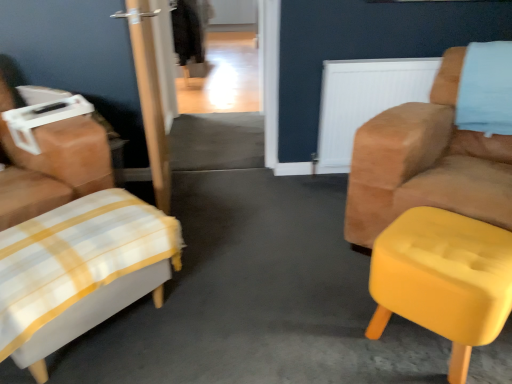
Locate an element on the screen. yellow fabric ottoman at right, arranged as the second furniture when viewed from the left is located at coordinates (443, 279).

Where is `suede tan armchair at right, the 1th chair when ordered from right to left`? The height and width of the screenshot is (384, 512). suede tan armchair at right, the 1th chair when ordered from right to left is located at coordinates (426, 163).

The width and height of the screenshot is (512, 384). Describe the element at coordinates (77, 269) in the screenshot. I see `white plaid ottoman at lower left, which is counted as the 1th furniture, starting from the left` at that location.

This screenshot has width=512, height=384. Identify the location of white textured radiator at upper right. (365, 100).

Identify the location of yellow fabric ottoman at right, which appears as the first furniture when viewed from the right. This screenshot has height=384, width=512. (443, 279).

Would you say white textured radiator at upper right is to the left or to the right of yellow fabric ottoman at right, which appears as the first furniture when viewed from the right, in the picture?

Based on their positions, white textured radiator at upper right is located to the right of yellow fabric ottoman at right, which appears as the first furniture when viewed from the right.

Considering the sizes of objects white textured radiator at upper right and yellow fabric ottoman at right, arranged as the second furniture when viewed from the left, in the image provided, who is smaller, white textured radiator at upper right or yellow fabric ottoman at right, arranged as the second furniture when viewed from the left,?

Result: With smaller size is white textured radiator at upper right.

Does white textured radiator at upper right have a lesser width compared to yellow fabric ottoman at right, which appears as the first furniture when viewed from the right?

Correct, the width of white textured radiator at upper right is less than that of yellow fabric ottoman at right, which appears as the first furniture when viewed from the right.

How different are the orientations of white textured radiator at upper right and yellow fabric ottoman at right, which appears as the first furniture when viewed from the right, in degrees?

43.5 degrees separate the facing orientations of white textured radiator at upper right and yellow fabric ottoman at right, which appears as the first furniture when viewed from the right.

Is the depth of suede tan armchair at right, the 1th chair when ordered from right to left, greater than that of white plaid ottoman at lower left, the second furniture from the right?

Yes, it is behind white plaid ottoman at lower left, the second furniture from the right.

Can you confirm if suede tan armchair at right, the 1th chair when ordered from right to left, is positioned to the right of white plaid ottoman at lower left, the second furniture from the right?

Yes, suede tan armchair at right, the 1th chair when ordered from right to left, is to the right of white plaid ottoman at lower left, the second furniture from the right.

From a real-world perspective, is suede tan armchair at right, which ranks as the second chair in left-to-right order, under white plaid ottoman at lower left, which is counted as the 1th furniture, starting from the left?

Actually, suede tan armchair at right, which ranks as the second chair in left-to-right order, is physically above white plaid ottoman at lower left, which is counted as the 1th furniture, starting from the left, in the real world.

How different are the orientations of suede tan armchair at right, the 1th chair when ordered from right to left, and white plaid ottoman at lower left, the second furniture from the right, in degrees?

They differ by 85.6 degrees in their facing directions.

Consider the image. Is suede tan armchair at right, which ranks as the second chair in left-to-right order, at the left side of white textured radiator at upper right?

No, suede tan armchair at right, which ranks as the second chair in left-to-right order, is not to the left of white textured radiator at upper right.

Which is closer to the camera, (367, 240) or (380, 100)?

The point (367, 240) is closer to the camera.

Looking at this image, is suede tan armchair at right, the 1th chair when ordered from right to left, looking in the opposite direction of white textured radiator at upper right?

No, suede tan armchair at right, the 1th chair when ordered from right to left, is not facing the opposite direction of white textured radiator at upper right.

From the image's perspective, which one is positioned lower, suede tan armchair at right, which ranks as the second chair in left-to-right order, or white textured radiator at upper right?

suede tan armchair at right, which ranks as the second chair in left-to-right order, from the image's perspective.

Is white plaid ottoman at lower left, which is counted as the 1th furniture, starting from the left, far away from white fabric ottoman at left, which ranks as the second chair in right-to-left order?

white plaid ottoman at lower left, which is counted as the 1th furniture, starting from the left, is actually quite close to white fabric ottoman at left, which ranks as the second chair in right-to-left order.

How different are the orientations of white plaid ottoman at lower left, which is counted as the 1th furniture, starting from the left, and white fabric ottoman at left, which ranks as the second chair in right-to-left order, in degrees?

The facing directions of white plaid ottoman at lower left, which is counted as the 1th furniture, starting from the left, and white fabric ottoman at left, which ranks as the second chair in right-to-left order, are 5.41 degrees apart.

Does white plaid ottoman at lower left, which is counted as the 1th furniture, starting from the left, have a smaller size compared to white fabric ottoman at left, placed as the first chair when sorted from left to right?

Indeed, white plaid ottoman at lower left, which is counted as the 1th furniture, starting from the left, has a smaller size compared to white fabric ottoman at left, placed as the first chair when sorted from left to right.

From the image's perspective, which object appears higher, suede tan armchair at right, which ranks as the second chair in left-to-right order, or white fabric ottoman at left, placed as the first chair when sorted from left to right?

suede tan armchair at right, which ranks as the second chair in left-to-right order.

Who is bigger, suede tan armchair at right, which ranks as the second chair in left-to-right order, or white fabric ottoman at left, which ranks as the second chair in right-to-left order?

With larger size is suede tan armchair at right, which ranks as the second chair in left-to-right order.

Is point (509, 209) closer to viewer compared to point (15, 175)?

Yes, it is.

Is yellow fabric ottoman at right, arranged as the second furniture when viewed from the left, located within suede tan armchair at right, the 1th chair when ordered from right to left?

No, yellow fabric ottoman at right, arranged as the second furniture when viewed from the left, is not inside suede tan armchair at right, the 1th chair when ordered from right to left.

Does suede tan armchair at right, the 1th chair when ordered from right to left, turn towards yellow fabric ottoman at right, which appears as the first furniture when viewed from the right?

Yes, suede tan armchair at right, the 1th chair when ordered from right to left, is aimed at yellow fabric ottoman at right, which appears as the first furniture when viewed from the right.

Which is in front, suede tan armchair at right, the 1th chair when ordered from right to left, or yellow fabric ottoman at right, arranged as the second furniture when viewed from the left?

Positioned in front is yellow fabric ottoman at right, arranged as the second furniture when viewed from the left.

From the picture: From the image's perspective, which is above, suede tan armchair at right, the 1th chair when ordered from right to left, or yellow fabric ottoman at right, which appears as the first furniture when viewed from the right?

suede tan armchair at right, the 1th chair when ordered from right to left, is shown above in the image.

Can you confirm if white fabric ottoman at left, placed as the first chair when sorted from left to right, is shorter than white textured radiator at upper right?

No.

In the scene shown: Does white fabric ottoman at left, which ranks as the second chair in right-to-left order, lie behind white textured radiator at upper right?

No.

Which is behind, point (0, 213) or point (332, 64)?

The point (332, 64) is behind.

Is white fabric ottoman at left, placed as the first chair when sorted from left to right, thinner than white textured radiator at upper right?

In fact, white fabric ottoman at left, placed as the first chair when sorted from left to right, might be wider than white textured radiator at upper right.

Identify the location of radiator that appears above the yellow fabric ottoman at right, arranged as the second furniture when viewed from the left (from the image's perspective). (365, 100).

At what (x,y) coordinates should I click in order to perform the action: click on chair on the right of the white plaid ottoman at lower left, which is counted as the 1th furniture, starting from the left. Please return your answer as a coordinate pair (x, y). Looking at the image, I should click on (426, 163).

Considering their positions, is suede tan armchair at right, which ranks as the second chair in left-to-right order, positioned closer to white plaid ottoman at lower left, which is counted as the 1th furniture, starting from the left, than white textured radiator at upper right?

suede tan armchair at right, which ranks as the second chair in left-to-right order, lies closer to white plaid ottoman at lower left, which is counted as the 1th furniture, starting from the left, than the other object.

Based on their spatial positions, is white textured radiator at upper right or white plaid ottoman at lower left, which is counted as the 1th furniture, starting from the left, closer to suede tan armchair at right, which ranks as the second chair in left-to-right order?

The object closer to suede tan armchair at right, which ranks as the second chair in left-to-right order, is white textured radiator at upper right.

Based on the photo, looking at the image, which one is located closer to suede tan armchair at right, the 1th chair when ordered from right to left, white fabric ottoman at left, placed as the first chair when sorted from left to right, or yellow fabric ottoman at right, which appears as the first furniture when viewed from the right?

yellow fabric ottoman at right, which appears as the first furniture when viewed from the right, is closer to suede tan armchair at right, the 1th chair when ordered from right to left.

Estimate the real-world distances between objects in this image. Which object is closer to white textured radiator at upper right, white plaid ottoman at lower left, the second furniture from the right, or white fabric ottoman at left, which ranks as the second chair in right-to-left order?

Among the two, white fabric ottoman at left, which ranks as the second chair in right-to-left order, is located nearer to white textured radiator at upper right.

Which object lies nearer to the anchor point suede tan armchair at right, the 1th chair when ordered from right to left, yellow fabric ottoman at right, arranged as the second furniture when viewed from the left, or white plaid ottoman at lower left, which is counted as the 1th furniture, starting from the left?

Among the two, yellow fabric ottoman at right, arranged as the second furniture when viewed from the left, is located nearer to suede tan armchair at right, the 1th chair when ordered from right to left.

From the picture: Which object lies further to the anchor point white plaid ottoman at lower left, which is counted as the 1th furniture, starting from the left, white fabric ottoman at left, placed as the first chair when sorted from left to right, or white textured radiator at upper right?

white textured radiator at upper right is further to white plaid ottoman at lower left, which is counted as the 1th furniture, starting from the left.

From the image, which object appears to be nearer to white plaid ottoman at lower left, the second furniture from the right, suede tan armchair at right, which ranks as the second chair in left-to-right order, or white fabric ottoman at left, which ranks as the second chair in right-to-left order?

Among the two, white fabric ottoman at left, which ranks as the second chair in right-to-left order, is located nearer to white plaid ottoman at lower left, the second furniture from the right.

Looking at the image, which one is located further to white textured radiator at upper right, suede tan armchair at right, which ranks as the second chair in left-to-right order, or white plaid ottoman at lower left, which is counted as the 1th furniture, starting from the left?

white plaid ottoman at lower left, which is counted as the 1th furniture, starting from the left, is positioned further to the anchor white textured radiator at upper right.

The width and height of the screenshot is (512, 384). What are the coordinates of `radiator located between white fabric ottoman at left, which ranks as the second chair in right-to-left order, and suede tan armchair at right, the 1th chair when ordered from right to left, in the left-right direction` in the screenshot? It's located at [365, 100].

What are the coordinates of `furniture between white plaid ottoman at lower left, the second furniture from the right, and suede tan armchair at right, the 1th chair when ordered from right to left` in the screenshot? It's located at (443, 279).

I want to click on furniture between white fabric ottoman at left, placed as the first chair when sorted from left to right, and yellow fabric ottoman at right, which appears as the first furniture when viewed from the right, from left to right, so click(x=77, y=269).

I want to click on radiator located between white plaid ottoman at lower left, which is counted as the 1th furniture, starting from the left, and suede tan armchair at right, which ranks as the second chair in left-to-right order, in the left-right direction, so click(365, 100).